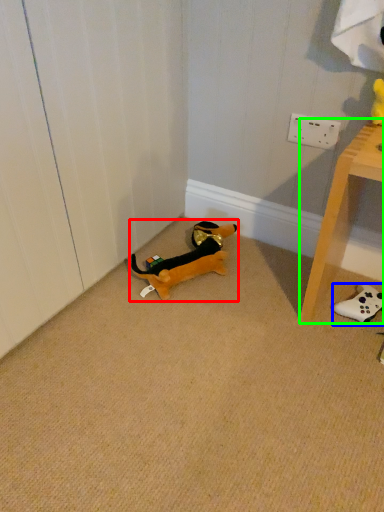
Question: Which is nearer to the toy (highlighted by a red box)? toy (highlighted by a blue box) or furniture (highlighted by a green box).

Choices:
 (A) toy
 (B) furniture

Answer: (B)